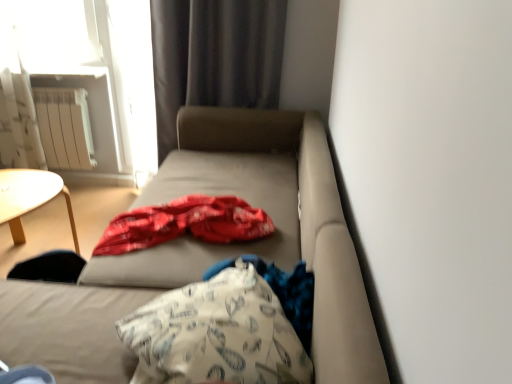
What do you see at coordinates (212, 253) in the screenshot?
I see `matte beige studio couch at center` at bounding box center [212, 253].

The width and height of the screenshot is (512, 384). What do you see at coordinates (290, 294) in the screenshot? I see `white printed fabric at center` at bounding box center [290, 294].

I want to click on matte beige studio couch at center, so click(212, 253).

Is white printed fabric at center positioned beyond the bounds of matte beige studio couch at center?

No.

Based on the photo, in terms of size, does white printed fabric at center appear bigger or smaller than matte beige studio couch at center?

Considering their sizes, white printed fabric at center takes up less space than matte beige studio couch at center.

From the picture: Considering their positions, is white printed fabric at center located in front of or behind matte beige studio couch at center?

Visually, white printed fabric at center is located behind matte beige studio couch at center.

Can you confirm if white printed fabric at center is shorter than matte beige studio couch at center?

Yes, white printed fabric at center is shorter than matte beige studio couch at center.

Is dark gray fabric curtain at upper center touching matte beige studio couch at center?

dark gray fabric curtain at upper center and matte beige studio couch at center are clearly separated.

Does dark gray fabric curtain at upper center have a larger size compared to matte beige studio couch at center?

No.

Considering the positions of objects dark gray fabric curtain at upper center and matte beige studio couch at center in the image provided, who is more to the right, dark gray fabric curtain at upper center or matte beige studio couch at center?

From the viewer's perspective, dark gray fabric curtain at upper center appears more on the right side.

Between point (162, 29) and point (38, 330), which one is positioned in front?

Point (38, 330)

Is white metallic radiator at upper left thinner than dark gray fabric curtain at upper center?

Indeed, white metallic radiator at upper left has a lesser width compared to dark gray fabric curtain at upper center.

Consider the image. How many degrees apart are the facing directions of white metallic radiator at upper left and dark gray fabric curtain at upper center?

2.3 degrees separate the facing orientations of white metallic radiator at upper left and dark gray fabric curtain at upper center.

Where is `curtain above the white metallic radiator at upper left (from a real-world perspective)`? The image size is (512, 384). curtain above the white metallic radiator at upper left (from a real-world perspective) is located at coordinates (214, 57).

Can you confirm if white metallic radiator at upper left is shorter than dark gray fabric curtain at upper center?

Yes, white metallic radiator at upper left is shorter than dark gray fabric curtain at upper center.

I want to click on curtain above the white printed fabric at center (from the image's perspective), so point(214,57).

How far apart are white printed fabric at center and dark gray fabric curtain at upper center?

1.64 meters.

Which object is more forward, white printed fabric at center or dark gray fabric curtain at upper center?

white printed fabric at center is more forward.

Which point is more forward, (x=287, y=297) or (x=247, y=55)?

Positioned in front is point (x=287, y=297).

Who is smaller, matte beige studio couch at center or white metallic radiator at upper left?

white metallic radiator at upper left is smaller.

Visually, is matte beige studio couch at center positioned to the left or to the right of white metallic radiator at upper left?

matte beige studio couch at center is positioned on white metallic radiator at upper left's right side.

Is matte beige studio couch at center wider or thinner than white metallic radiator at upper left?

Considering their sizes, matte beige studio couch at center looks broader than white metallic radiator at upper left.

From a real-world perspective, who is located higher, matte beige studio couch at center or white metallic radiator at upper left?

In real-world perspective, white metallic radiator at upper left is above.

From a real-world perspective, is dark gray fabric curtain at upper center positioned above or below white printed fabric at center?

From a real-world perspective, dark gray fabric curtain at upper center is physically above white printed fabric at center.

Is the surface of dark gray fabric curtain at upper center in direct contact with white printed fabric at center?

No, dark gray fabric curtain at upper center is not with white printed fabric at center.

Which is in front, dark gray fabric curtain at upper center or white printed fabric at center?

white printed fabric at center is in front.

From the image's perspective, is dark gray fabric curtain at upper center above white printed fabric at center?

Yes, from the image's perspective, dark gray fabric curtain at upper center is above white printed fabric at center.

Which object is wider, white metallic radiator at upper left or white printed fabric at center?

white printed fabric at center.

Consider the image. Is white metallic radiator at upper left turned away from white printed fabric at center?

white metallic radiator at upper left does not have its back to white printed fabric at center.

At what (x,y) coordinates should I click in order to perform the action: click on radiator above the white printed fabric at center (from the image's perspective). Please return your answer as a coordinate pair (x, y). The image size is (512, 384). Looking at the image, I should click on (65, 127).

Between white metallic radiator at upper left and white printed fabric at center, which one has larger size?

Bigger between the two is white printed fabric at center.

The image size is (512, 384). In order to click on studio couch located underneath the white printed fabric at center (from a real-world perspective) in this screenshot , I will do `click(212, 253)`.

The image size is (512, 384). What are the coordinates of `studio couch in front of the dark gray fabric curtain at upper center` in the screenshot? It's located at [x=212, y=253].

Looking at the image, which one is located further to white fabric throw pillow at center, dark gray fabric curtain at upper center or white metallic radiator at upper left?

white metallic radiator at upper left is further to white fabric throw pillow at center.

Estimate the real-world distances between objects in this image. Which object is closer to white printed fabric at center, matte beige studio couch at center or white metallic radiator at upper left?

matte beige studio couch at center.

When comparing their distances from matte beige studio couch at center, does white fabric throw pillow at center or white metallic radiator at upper left seem further?

white metallic radiator at upper left.

When comparing their distances from dark gray fabric curtain at upper center, does white fabric throw pillow at center or white metallic radiator at upper left seem closer?

white metallic radiator at upper left is closer to dark gray fabric curtain at upper center.

Considering their positions, is matte beige studio couch at center positioned further to white metallic radiator at upper left than white fabric throw pillow at center?

white fabric throw pillow at center.

Based on the photo, estimate the real-world distances between objects in this image. Which object is further from matte beige studio couch at center, white printed fabric at center or white metallic radiator at upper left?

Based on the image, white metallic radiator at upper left appears to be further to matte beige studio couch at center.

When comparing their distances from matte beige studio couch at center, does white metallic radiator at upper left or dark gray fabric curtain at upper center seem further?

white metallic radiator at upper left is further to matte beige studio couch at center.

Based on their spatial positions, is matte beige studio couch at center or white fabric throw pillow at center closer to white printed fabric at center?

white fabric throw pillow at center lies closer to white printed fabric at center than the other object.

Where is `clothing between matte beige studio couch at center and white metallic radiator at upper left in the front-back direction`? This screenshot has height=384, width=512. clothing between matte beige studio couch at center and white metallic radiator at upper left in the front-back direction is located at coordinates tap(290, 294).

Locate an element on the screen. curtain positioned between white fabric throw pillow at center and white metallic radiator at upper left from near to far is located at coordinates pyautogui.click(x=214, y=57).

Find the location of `throw pillow located between matte beige studio couch at center and dark gray fabric curtain at upper center in the depth direction`. throw pillow located between matte beige studio couch at center and dark gray fabric curtain at upper center in the depth direction is located at coordinates (216, 334).

You are a GUI agent. You are given a task and a screenshot of the screen. Output one action in this format:
    pyautogui.click(x=<x>, y=<y>)
    Task: Click on the clothing positioned between white fabric throw pillow at center and white metallic radiator at upper left from near to far
    Image resolution: width=512 pixels, height=384 pixels.
    Given the screenshot: What is the action you would take?
    pyautogui.click(x=290, y=294)